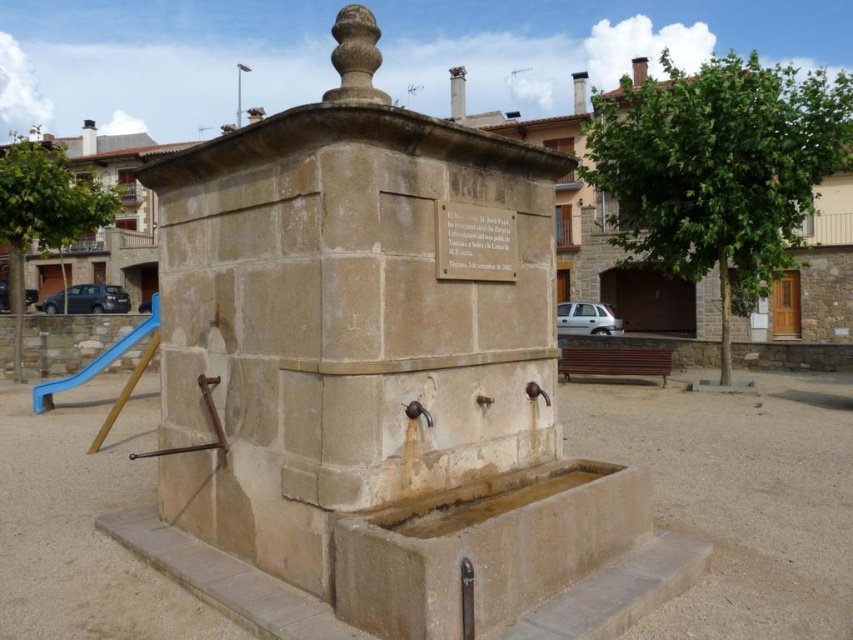
You are a parent trying to locate your child who is playing in the park. You see the stone plaque at center and the blue plastic slide at left. Which object is closer to the left side of the image?

The blue plastic slide at left is closer to the left side of the image because the stone plaque at center is positioned on the right side of it.

You are standing in front of the stone fountain in the public square. You notice two points marked on the fountain. One is at coordinate point (434, 220) and the other at point (91, 362). Which of these points is closer to your current position?

Point (434, 220) is closer to the camera than point (91, 362), so the point at (434, 220) is closer to your current position.

You are a parent watching your child play at the park. You see the stone plaque at center and the blue plastic slide at left. Which object is closer to you?

The stone plaque at center is closer to you because it is in front of the blue plastic slide at left.